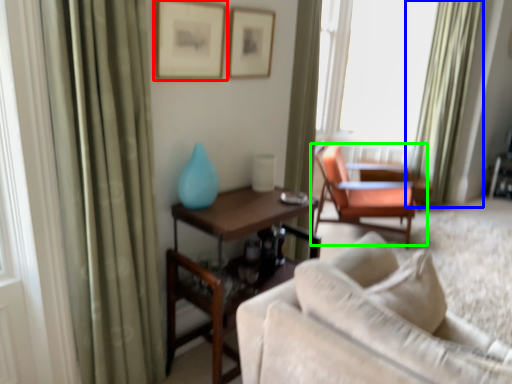
Question: Which object is positioned closest to picture frame (highlighted by a red box)? Select from curtain (highlighted by a blue box) and chair (highlighted by a green box).

Choices:
 (A) curtain
 (B) chair

Answer: (B)